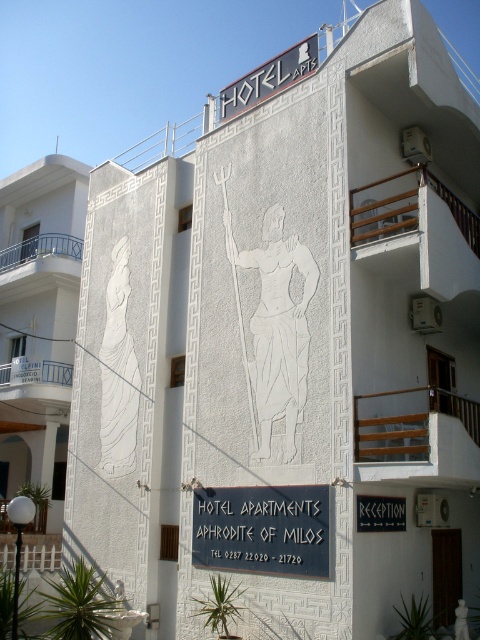
A tourist is standing at point (315,61) and wants to take a photo of the relief sculptures on the Hotel Apartments Aphrodite of Milos. If the camera has a maximum zoom range of 60 feet, will they be able to capture both sculptures in the photo without moving closer?

The two relief sculptures are 64.34 feet apart. Since the camera can only zoom up to 60 feet, the tourist will not be able to capture both sculptures in the photo without moving closer.

You are a tourist standing in front of the Hotel Apartments Aphrodite of Milos. You notice two signs on the building facade. The first is the white plastic sign at upper center, and the second is the black matte sign at center. Which sign appears closer to you?

The white plastic sign at upper center appears closer to you because the black matte sign at center is behind it.

You are standing at the entrance of the HOTEL APARTMENTS APHRODITE OF MILOS and need to hang a new 1.5 meter wide decorative banner between the black metal signboard at center and the white plastic sign at upper center. Is there enough space between them to fit the banner horizontally?

The black metal signboard at center and white plastic sign at upper center are 11.25 meters apart, so yes, there is enough space to fit a 1.5 meter wide banner between them horizontally.